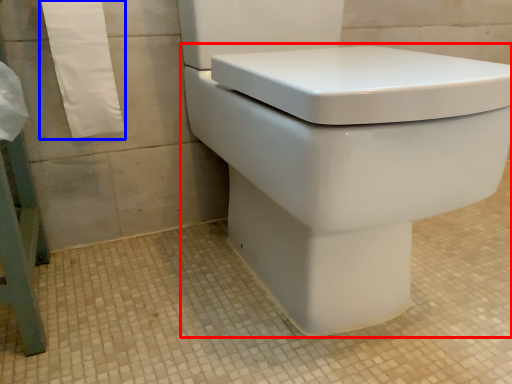
Question: Among these objects, which one is farthest to the camera, toilet (highlighted by a red box) or bath towel (highlighted by a blue box)?

Choices:
 (A) toilet
 (B) bath towel

Answer: (B)